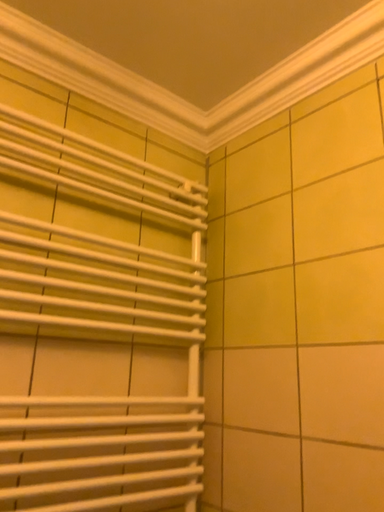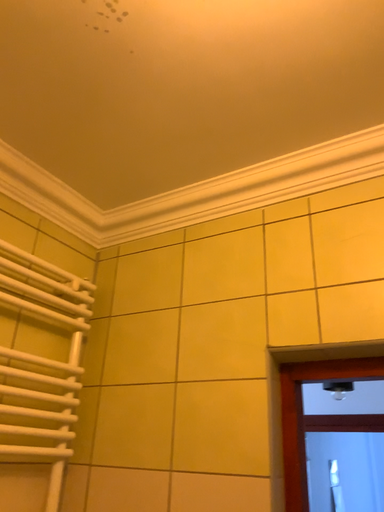
Question: Which way did the camera rotate in the video?

Choices:
 (A) rotated downward
 (B) rotated upward

Answer: (B)